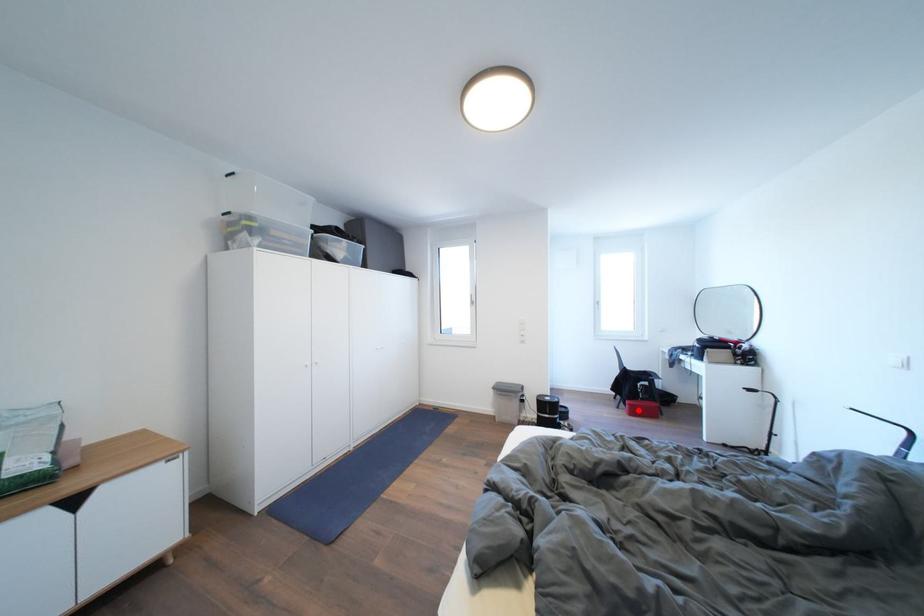
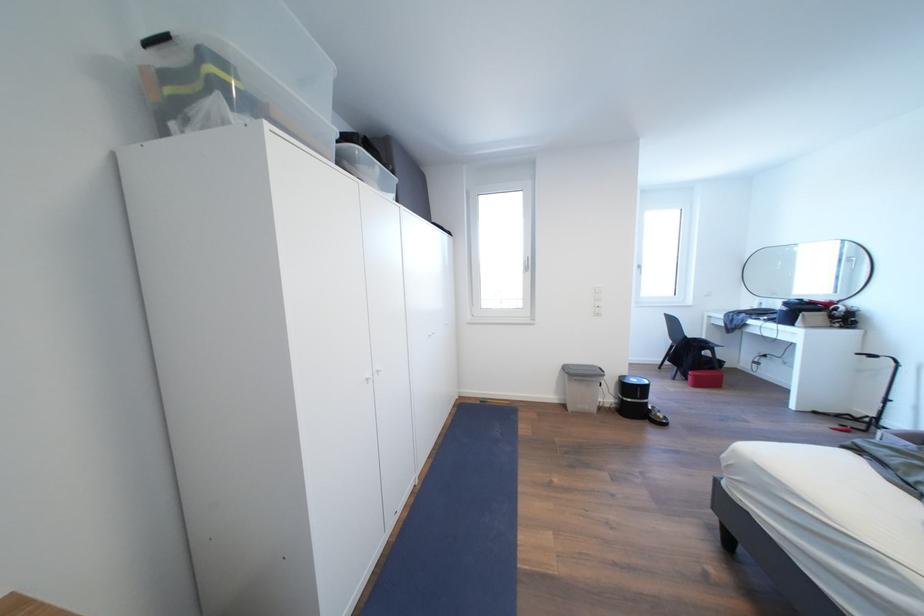
Question: I am providing you with two images of the same scene from different viewpoints. A red point is shown in image1. For the corresponding object point in image2, is it positioned nearer or farther from the camera?

Choices:
 (A) Nearer
 (B) Farther

Answer: (A)